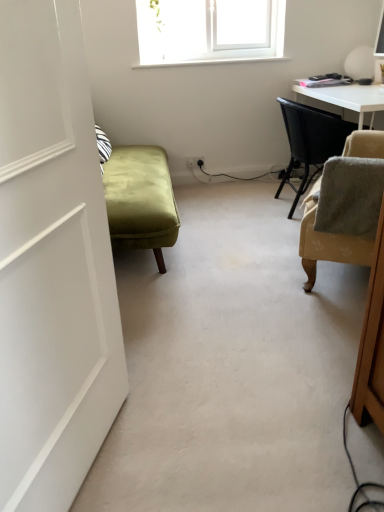
Identify the location of vacant space behind white matte door at left. The width and height of the screenshot is (384, 512). (163, 378).